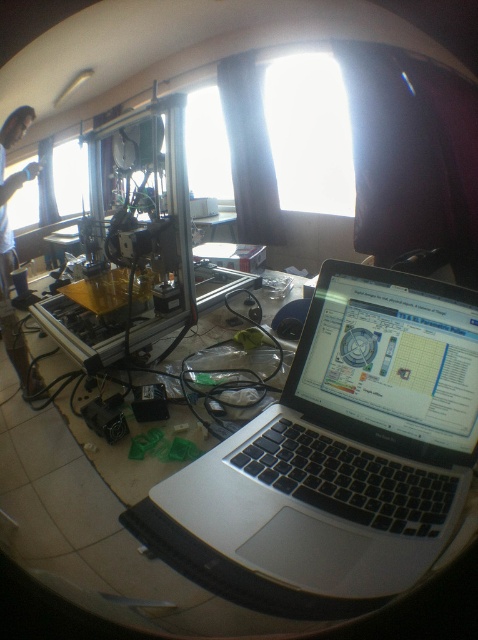
You are standing in front of the 3D printer in the middle ground and want to reach both the point at (240, 554) and the point at (11, 244). Which point should you reach for first to minimize the distance walked?

You should reach for point (240, 554) first because it is closer to you than point (11, 244).